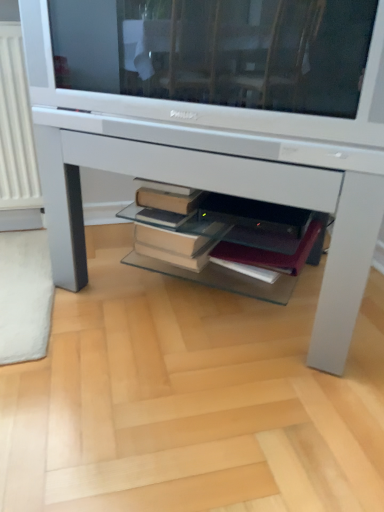
Where is `maroon leather notebook at center`? maroon leather notebook at center is located at coordinates (271, 252).

Where is `white glossy desk at center`? white glossy desk at center is located at coordinates (217, 191).

This screenshot has height=512, width=384. In order to click on white glossy television at upper center in this screenshot , I will do `click(204, 104)`.

Locate an element on the screen. Image resolution: width=384 pixels, height=512 pixels. maroon leather notebook at center is located at coordinates (271, 252).

Is maroon leather notebook at center bigger or smaller than white glossy desk at center?

In the image, maroon leather notebook at center appears to be smaller than white glossy desk at center.

From a real-world perspective, is maroon leather notebook at center under white glossy desk at center?

Indeed, from a real-world perspective, maroon leather notebook at center is positioned beneath white glossy desk at center.

Looking at this image, is maroon leather notebook at center next to white glossy desk at center?

No.

From their relative heights in the image, would you say maroon leather notebook at center is taller or shorter than white glossy desk at center?

maroon leather notebook at center is shorter than white glossy desk at center.

Considering the sizes of objects white glossy television at upper center and white glossy desk at center in the image provided, who is smaller, white glossy television at upper center or white glossy desk at center?

white glossy television at upper center.

Considering the sizes of objects white glossy television at upper center and white glossy desk at center in the image provided, who is taller, white glossy television at upper center or white glossy desk at center?

Standing taller between the two is white glossy desk at center.

Is there a large distance between white glossy television at upper center and white glossy desk at center?

They are positioned close to each other.

What's the angular difference between white glossy television at upper center and white glossy desk at center's facing directions?

white glossy television at upper center and white glossy desk at center are facing 2.29e-05 degrees away from each other.

Considering the relative sizes of white glossy desk at center and white glossy television at upper center in the image provided, is white glossy desk at center taller than white glossy television at upper center?

Yes.

The height and width of the screenshot is (512, 384). I want to click on desk lying behind the white glossy television at upper center, so click(x=217, y=191).

From the image's perspective, between white glossy desk at center and white glossy television at upper center, which one is located above?

white glossy television at upper center is shown above in the image.

Considering the relative positions of white glossy desk at center and white glossy television at upper center in the image provided, is white glossy desk at center to the left of white glossy television at upper center from the viewer's perspective?

Incorrect, white glossy desk at center is not on the left side of white glossy television at upper center.

Is maroon leather notebook at center beside white glossy television at upper center?

No, maroon leather notebook at center is not in contact with white glossy television at upper center.

Where is `television above the maroon leather notebook at center (from a real-world perspective)`? television above the maroon leather notebook at center (from a real-world perspective) is located at coordinates (204, 104).

Can you tell me how much maroon leather notebook at center and white glossy television at upper center differ in facing direction?

5.8 degrees.

Which object is wider, maroon leather notebook at center or white glossy television at upper center?

With larger width is white glossy television at upper center.

Is white glossy desk at center far from maroon leather notebook at center?

white glossy desk at center is actually quite close to maroon leather notebook at center.

Is maroon leather notebook at center located within white glossy desk at center?

Yes, white glossy desk at center contains maroon leather notebook at center.

Is white glossy desk at center bigger or smaller than maroon leather notebook at center?

Considering their sizes, white glossy desk at center takes up more space than maroon leather notebook at center.

You are a GUI agent. You are given a task and a screenshot of the screen. Output one action in this format:
    pyautogui.click(x=<x>, y=<y>)
    Task: Click on the desk located on the left of maroon leather notebook at center
    
    Given the screenshot: What is the action you would take?
    pyautogui.click(x=217, y=191)

Considering the sizes of objects white glossy television at upper center and maroon leather notebook at center in the image provided, who is shorter, white glossy television at upper center or maroon leather notebook at center?

Standing shorter between the two is maroon leather notebook at center.

Is white glossy television at upper center turned away from maroon leather notebook at center?

No.

From a real-world perspective, is white glossy television at upper center on top of maroon leather notebook at center?

Yes, from a real-world perspective, white glossy television at upper center is above maroon leather notebook at center.

Identify the location of paperback book located underneath the white glossy desk at center (from a real-world perspective). (271, 252).

This screenshot has height=512, width=384. What are the coordinates of `desk that is below the white glossy television at upper center (from the image's perspective)` in the screenshot? It's located at (217, 191).

When comparing their distances from white glossy television at upper center, does maroon leather notebook at center or white glossy desk at center seem closer?

white glossy desk at center.

Based on their spatial positions, is white glossy television at upper center or white glossy desk at center closer to maroon leather notebook at center?

white glossy desk at center lies closer to maroon leather notebook at center than the other object.

Looking at the image, which one is located further to white glossy desk at center, maroon leather notebook at center or white glossy television at upper center?

Among the two, maroon leather notebook at center is located further to white glossy desk at center.

Looking at the image, which one is located further to white glossy desk at center, white glossy television at upper center or maroon leather notebook at center?

maroon leather notebook at center is further to white glossy desk at center.

When comparing their distances from maroon leather notebook at center, does white glossy desk at center or white glossy television at upper center seem closer?

Based on the image, white glossy desk at center appears to be nearer to maroon leather notebook at center.

Based on the photo, looking at the image, which one is located closer to white glossy television at upper center, white glossy desk at center or maroon leather notebook at center?

Based on the image, white glossy desk at center appears to be nearer to white glossy television at upper center.

Locate an element on the screen. desk between white glossy television at upper center and maroon leather notebook at center from top to bottom is located at coordinates pos(217,191).